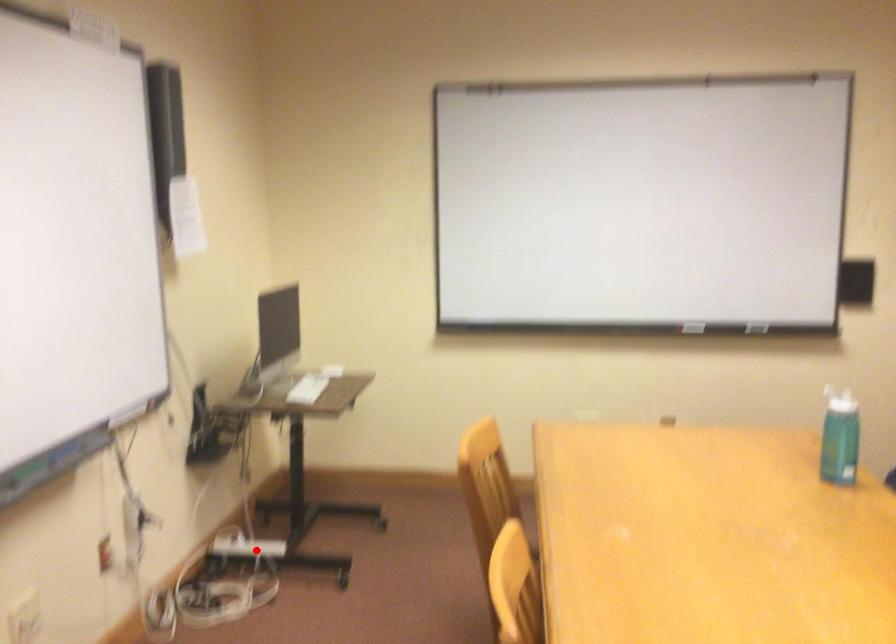
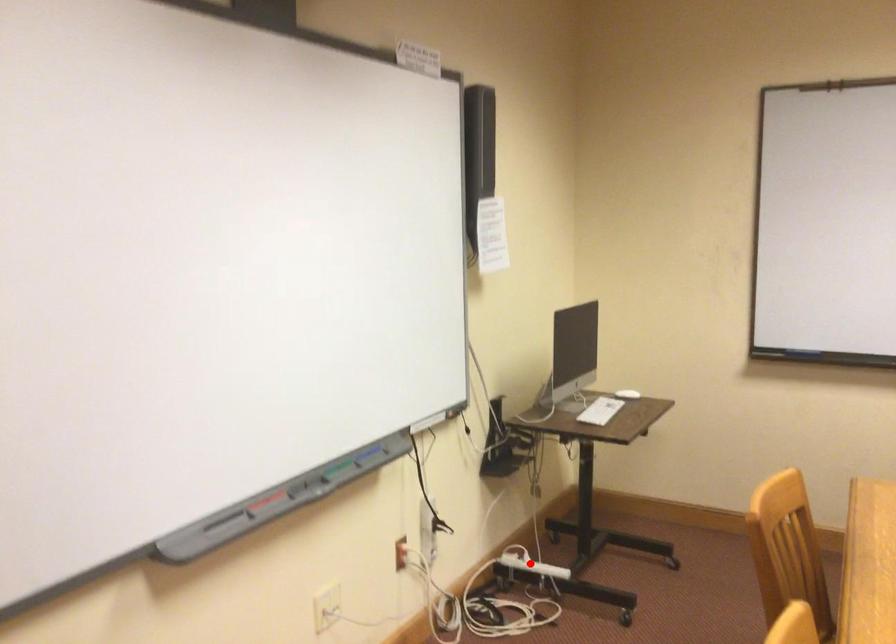
I am providing you with two images of the same scene from different viewpoints. A red point is marked on the first image and another point is marked on the second image. Is the marked point in image1 the same physical position as the marked point in image2?

Yes